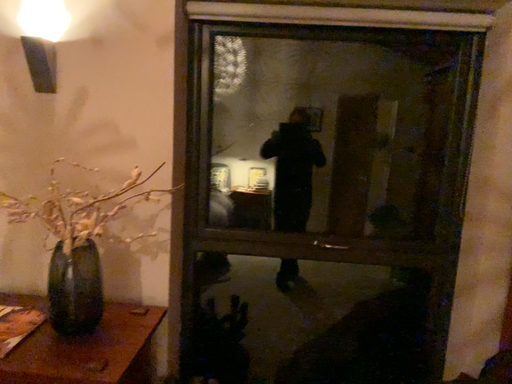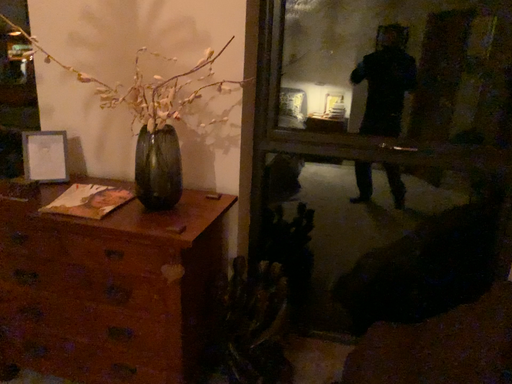
Question: Which way did the camera rotate in the video?

Choices:
 (A) rotated upward
 (B) rotated downward

Answer: (B)